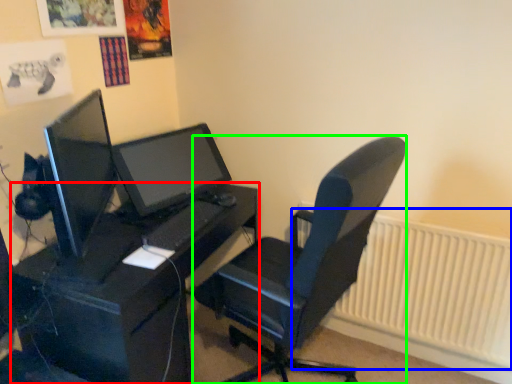
Question: Estimate the real-world distances between objects in this image. Which object is closer to desk (highlighted by a red box), radiator (highlighted by a blue box) or chair (highlighted by a green box)?

Choices:
 (A) radiator
 (B) chair

Answer: (B)